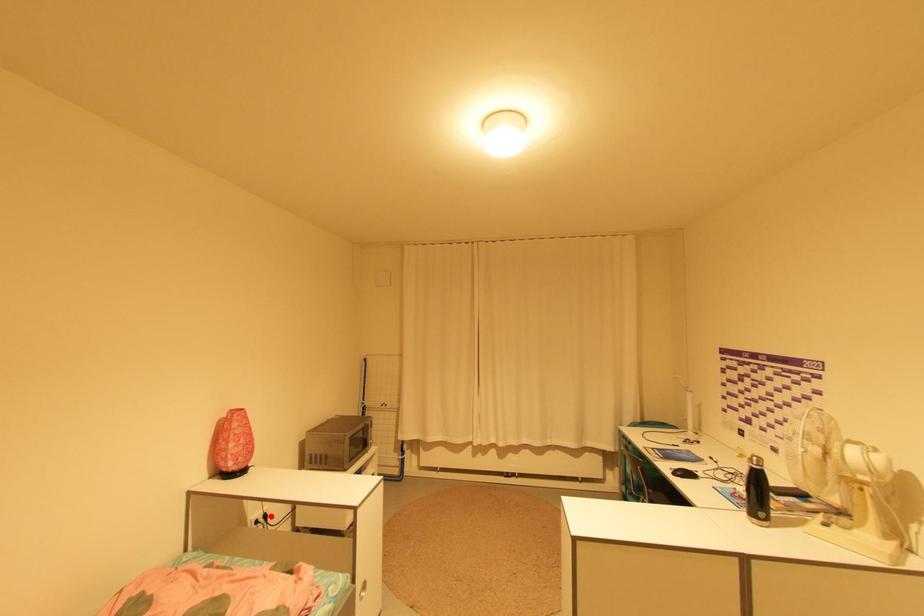
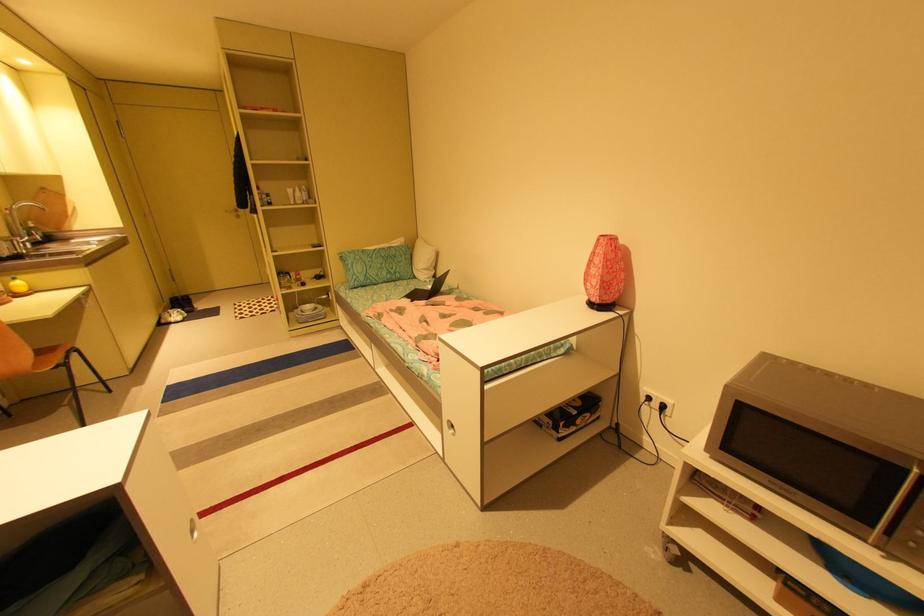
The point at the highlighted location is marked in the first image. Where is the corresponding point in the second image?

(669, 407)